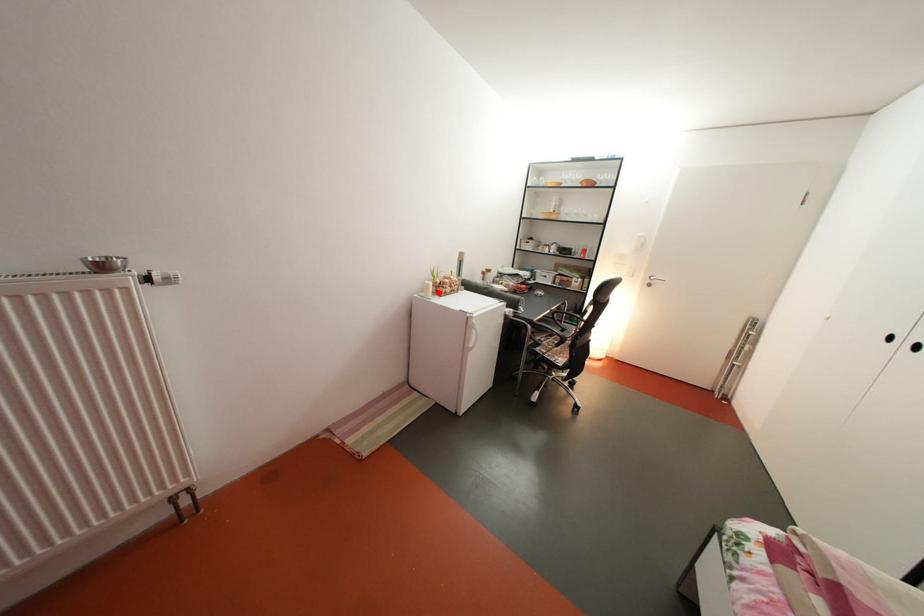
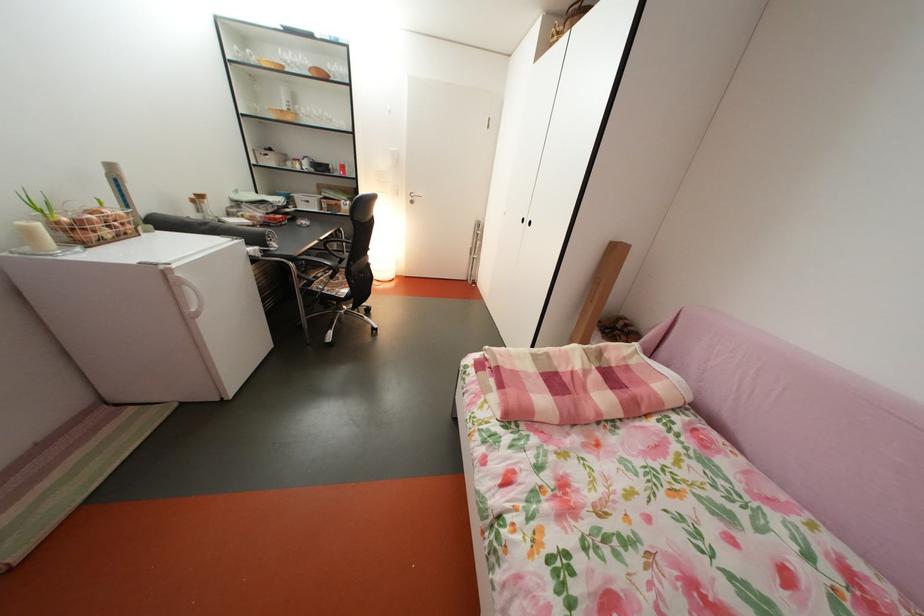
Locate, in the second image, the point that corresponds to the highlighted location in the first image.

(41, 238)